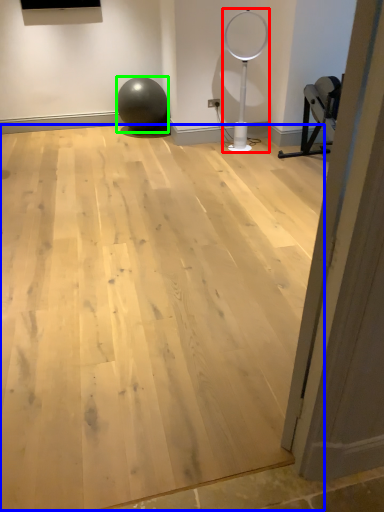
Question: Which is farther away from basketball hoop (highlighted by a red box)? plywood (highlighted by a blue box) or ball (highlighted by a green box)?

Choices:
 (A) plywood
 (B) ball

Answer: (A)